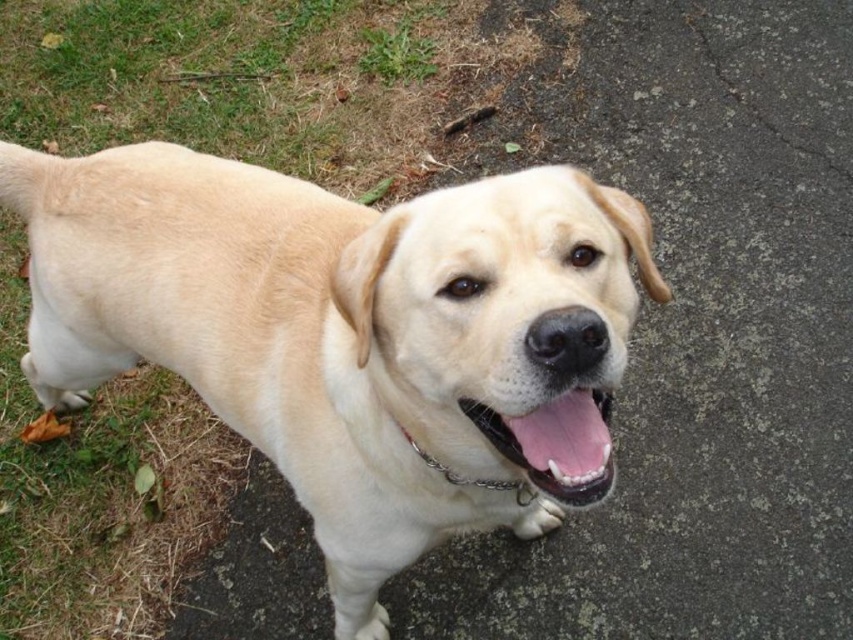
Based on the photo, can you confirm if light beige fur dog at center is taller than pink glossy tongue at center?

Correct, light beige fur dog at center is much taller as pink glossy tongue at center.

The height and width of the screenshot is (640, 853). Identify the location of light beige fur dog at center. (344, 330).

Is light beige fur dog at center above metal chain at center?

Indeed, light beige fur dog at center is positioned over metal chain at center.

Is light beige fur dog at center further to the viewer compared to metal chain at center?

No, light beige fur dog at center is closer to the viewer.

Is point (380, 352) more distant than point (447, 474)?

No, it is not.

This screenshot has height=640, width=853. Find the location of `light beige fur dog at center`. light beige fur dog at center is located at coordinates (344, 330).

Is pink glossy tongue at center wider than metal chain at center?

No, pink glossy tongue at center is not wider than metal chain at center.

Does pink glossy tongue at center appear under metal chain at center?

No.

This screenshot has width=853, height=640. In order to click on pink glossy tongue at center in this screenshot , I will do `click(549, 468)`.

You are a GUI agent. You are given a task and a screenshot of the screen. Output one action in this format:
    pyautogui.click(x=<x>, y=<y>)
    Task: Click on the pink glossy tongue at center
    Image resolution: width=853 pixels, height=640 pixels.
    Given the screenshot: What is the action you would take?
    pyautogui.click(x=549, y=468)